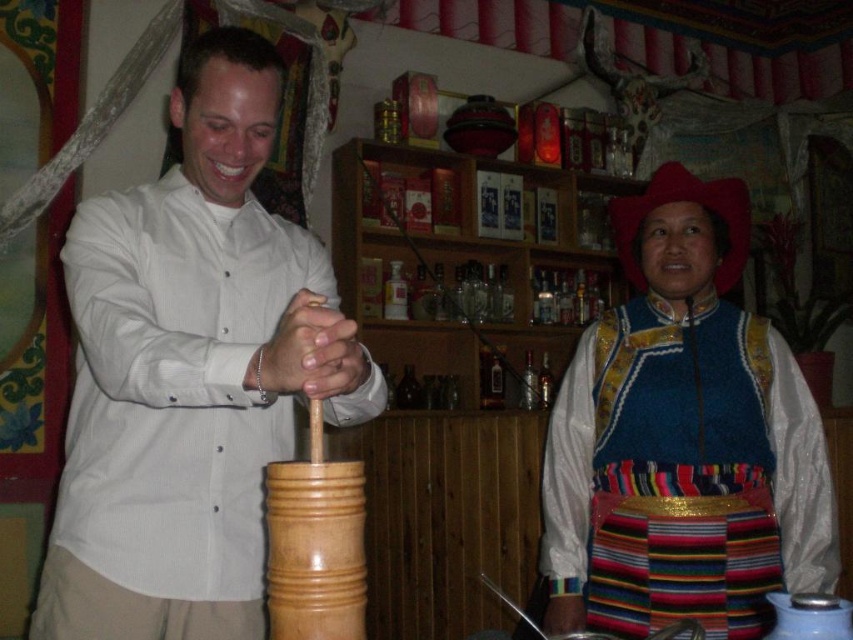
Is point (178, 417) closer to camera compared to point (671, 204)?

Yes.

Where is `white matte shirt at center`? white matte shirt at center is located at coordinates (190, 371).